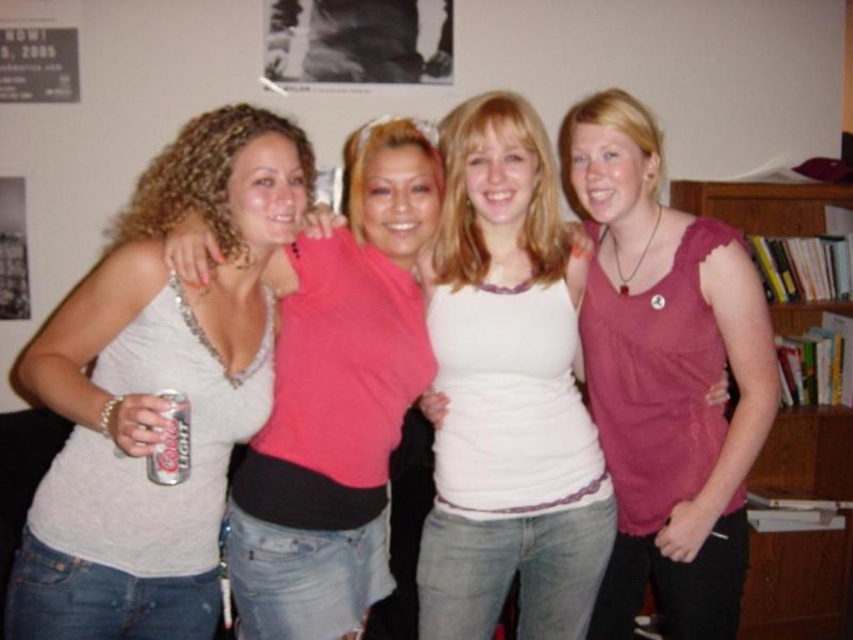
You are standing in the room and want to locate the pink fabric tank top at center. According to the coordinates provided, where should you look?

You should look at point (665, 376) to find the pink fabric tank top at center.

You are a photographer trying to capture a shot of the white matte tank top at center and the silver metallic can at lower left. Which object should you focus on first if you want to ensure both are in focus without moving the camera? Explain your reasoning based on their positions.

The white matte tank top at center is to the right of the silver metallic can at lower left. Since they are positioned at different horizontal positions, you should focus on the object that is further away from the camera to achieve depth of field. However, without knowing their exact distances, it is recommended to focus on the silver metallic can at lower left as it is lower and possibly closer, ensuring both are in focus.

You are a photographer trying to capture a photo of the wooden bookshelf at right without including the pink fabric tank top at center in the frame. Based on their heights, is this possible?

The pink fabric tank top at center is much taller than the wooden bookshelf at right, so it would block the view of the wooden bookshelf at right. Therefore, it is not possible to take a photo of the wooden bookshelf at right without including the pink fabric tank top at center in the frame.